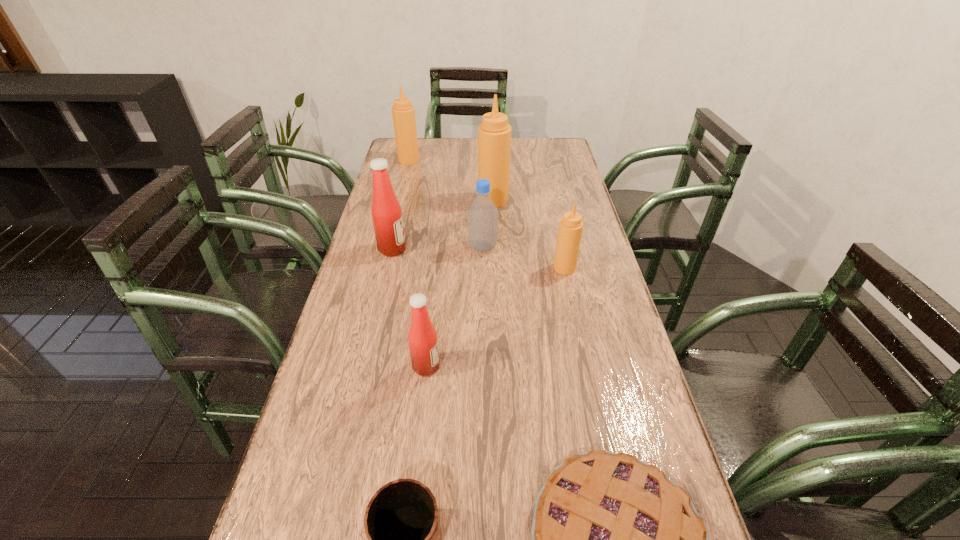
Where is `free space at the far edge`? The width and height of the screenshot is (960, 540). free space at the far edge is located at coordinates (519, 139).

In the image, there is a desktop. At what (x,y) coordinates should I click in order to perform the action: click on free space at the left edge. Please return your answer as a coordinate pair (x, y). This screenshot has height=540, width=960. Looking at the image, I should click on (374, 232).

Locate an element on the screen. free location at the right edge is located at coordinates (605, 412).

You are a GUI agent. You are given a task and a screenshot of the screen. Output one action in this format:
    pyautogui.click(x=<x>, y=<y>)
    Task: Click on the vacant space that is in between the third condiment from left to right and the bigger red condiment
    
    Given the screenshot: What is the action you would take?
    click(410, 308)

This screenshot has width=960, height=540. Find the location of `free space between the left red condiment and the nearer red condiment`. free space between the left red condiment and the nearer red condiment is located at coordinates (410, 308).

The height and width of the screenshot is (540, 960). I want to click on free spot between the third condiment from right to left and the fourth nearest object, so click(495, 317).

The height and width of the screenshot is (540, 960). I want to click on free spot between the tallest condiment and the farthest object, so click(x=451, y=180).

You are a GUI agent. You are given a task and a screenshot of the screen. Output one action in this format:
    pyautogui.click(x=<x>, y=<y>)
    Task: Click on the empty space between the third farthest condiment and the nearer red condiment
    This screenshot has height=540, width=960.
    Given the screenshot: What is the action you would take?
    (x=410, y=308)

At what (x,y) coordinates should I click in order to perform the action: click on empty location between the gray bottle and the smaller red condiment. Please return your answer as a coordinate pair (x, y). Looking at the image, I should click on (455, 307).

What are the coordinates of `object identified as the third closest to the rust mug` in the screenshot? It's located at (570, 230).